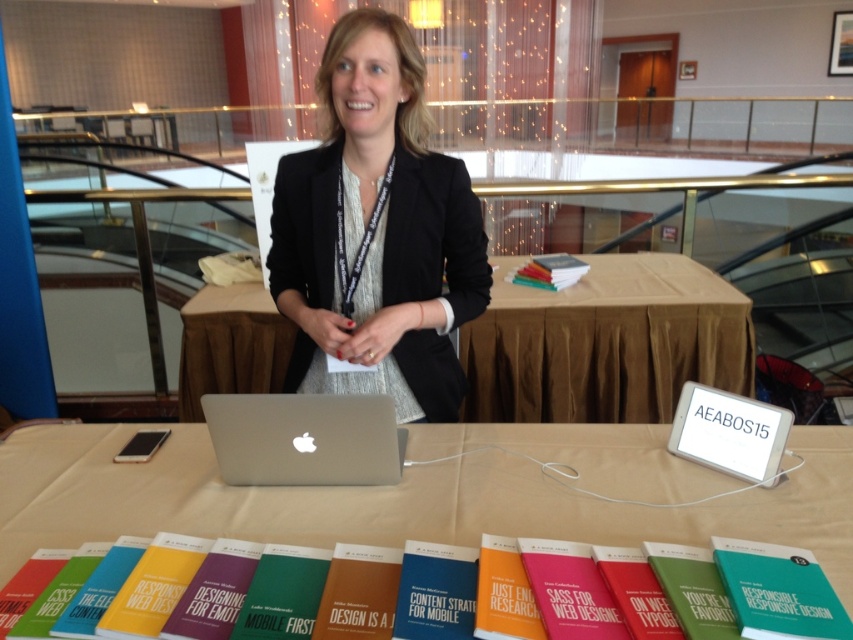
You are an event assistant who needs to hand out materials to attendees. You have a white paper at center and a blue hardcover book at center on the table. If you want to place a new folder between them, what is the minimum distance you should leave between the folder and each object?

The white paper at center and blue hardcover book at center are 15.13 inches apart. To place a new folder between them, the minimum distance between the folder and each object should be at least half of 15.13 inches, which is approximately 7.56 inches.

You are attending a conference and need to locate two specific points on the table in front of the presenter. The first point is at coordinates point (433, 572) and the second is at point (543, 284). From your perspective as an attendee, which point is closer to you?

Point (433, 572) is closer to the camera than point (543, 284), so from your perspective as an attendee, point (433, 572) is closer to you.